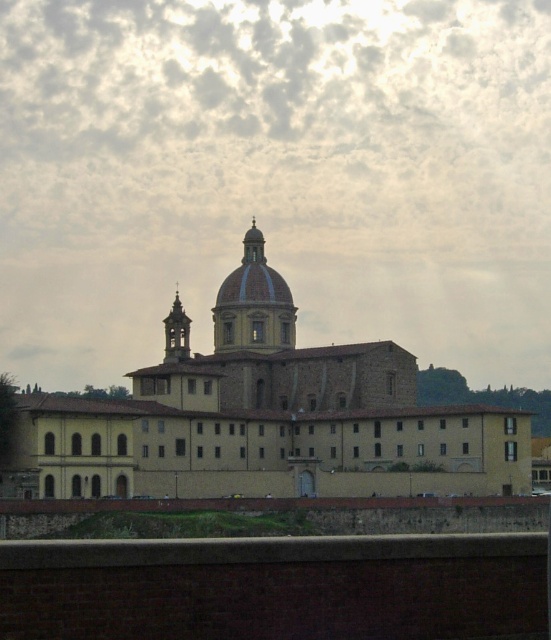
Question: Which is farther from the matte brown dome at center?

Choices:
 (A) gold textured bell tower at center
 (B) yellow matte building at center
 (C) cloudy sky at upper center

Answer: (C)

Question: Can you confirm if cloudy sky at upper center is smaller than gold textured bell tower at center?

Choices:
 (A) no
 (B) yes

Answer: (A)

Question: Which point is closer to the camera?

Choices:
 (A) cloudy sky at upper center
 (B) yellow matte building at center
 (C) gold textured bell tower at center
 (D) matte brown dome at center

Answer: (B)

Question: Does cloudy sky at upper center appear on the left side of yellow matte building at center?

Choices:
 (A) yes
 (B) no

Answer: (A)

Question: Which of the following is the closest to the observer?

Choices:
 (A) (171, 432)
 (B) (213, 312)
 (C) (176, 312)
 (D) (418, 188)

Answer: (A)

Question: Observing the image, what is the correct spatial positioning of cloudy sky at upper center in reference to matte brown dome at center?

Choices:
 (A) left
 (B) right

Answer: (A)